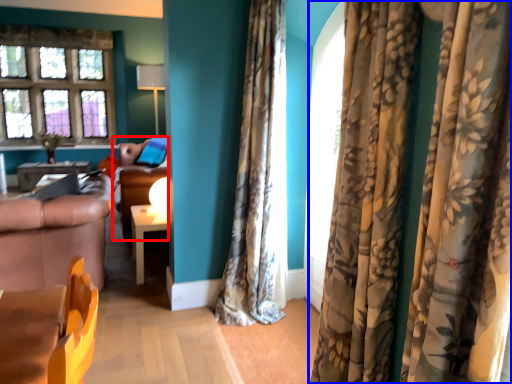
Question: Which object appears farthest to the camera in this image, couch (highlighted by a red box) or curtain (highlighted by a blue box)?

Choices:
 (A) couch
 (B) curtain

Answer: (A)